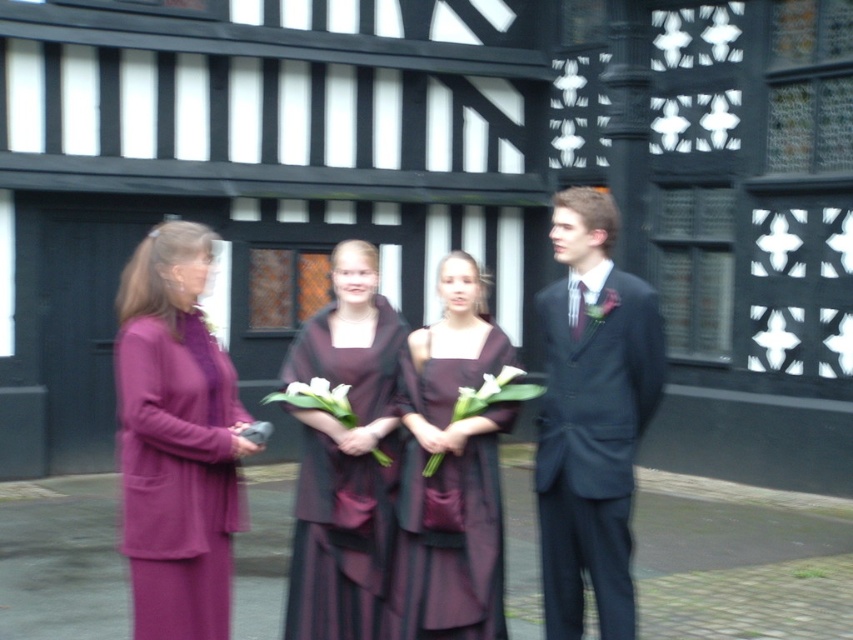
You are a photographer standing at point (x=177, y=440). You need to take a picture of the purple matte dress at left. Is the dress in your current position?

Yes, the purple matte dress at left is located at point (x=177, y=440), so the dress is in your current position.

Consider the image. You are standing in front of the building with black and white timber framing and want to take a photo of the two points marked in the image. Which point, point (606,401) or point (432,461), is closer to you?

Point (606,401) is closer to the viewer than point (432,461).